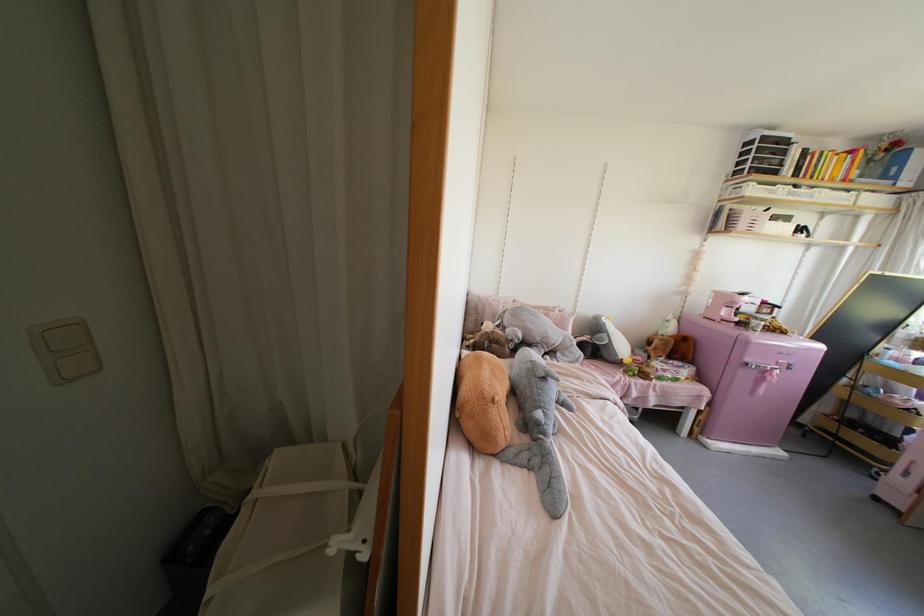
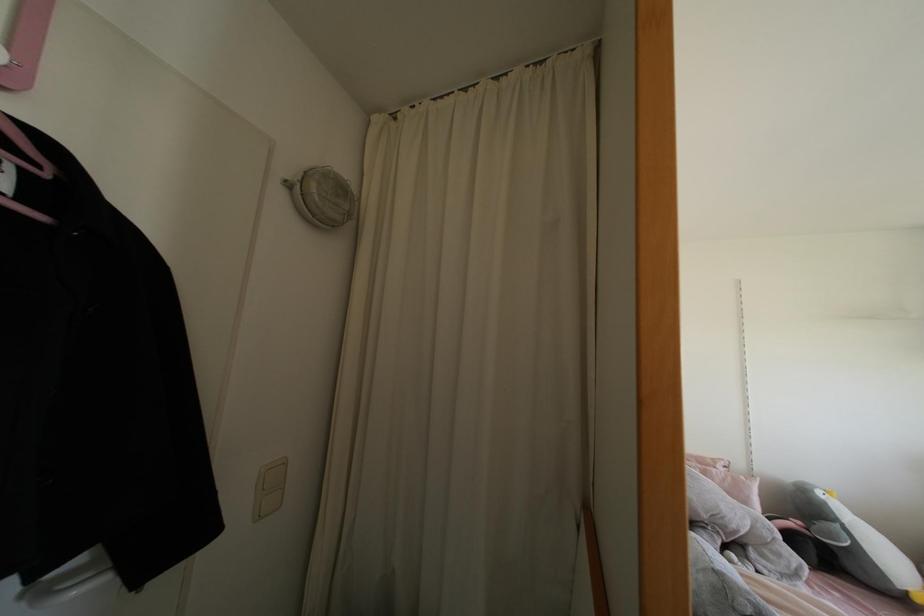
Where in the second image is the point corresponding to [602,318] from the first image?

(819, 493)